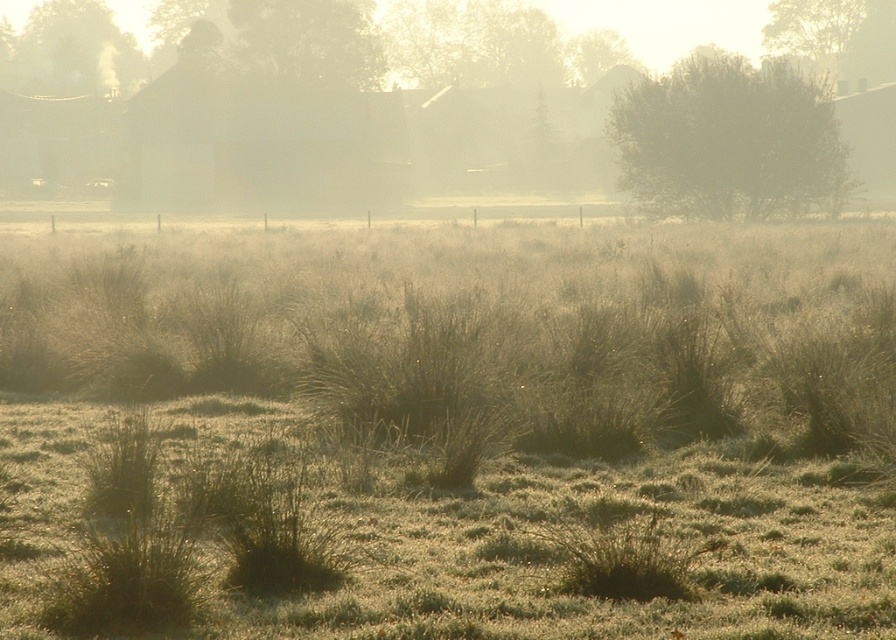
Measure the distance from green leafy bush at upper right to green grass at upper left.

The distance of green leafy bush at upper right from green grass at upper left is 53.39 meters.

Between green leafy bush at upper right and green grass at upper left, which one is positioned lower?

Positioned lower is green leafy bush at upper right.

Who is more forward, [750,154] or [16,81]?

Positioned in front is point [750,154].

The height and width of the screenshot is (640, 896). Find the location of `green leafy bush at upper right`. green leafy bush at upper right is located at coordinates (729, 141).

Is green leafy bush at upper right shorter than green leafy tree at upper center?

No.

Does green leafy bush at upper right appear on the right side of green leafy tree at upper center?

Yes, green leafy bush at upper right is to the right of green leafy tree at upper center.

This screenshot has height=640, width=896. What do you see at coordinates (729, 141) in the screenshot?
I see `green leafy bush at upper right` at bounding box center [729, 141].

Image resolution: width=896 pixels, height=640 pixels. I want to click on green leafy bush at upper right, so click(729, 141).

Which is in front, point (257, 22) or point (1, 42)?

Point (257, 22) is more forward.

Is point (317, 19) positioned behind point (42, 33)?

No, it is not.

Identify the location of green leafy tree at upper center. (309, 42).